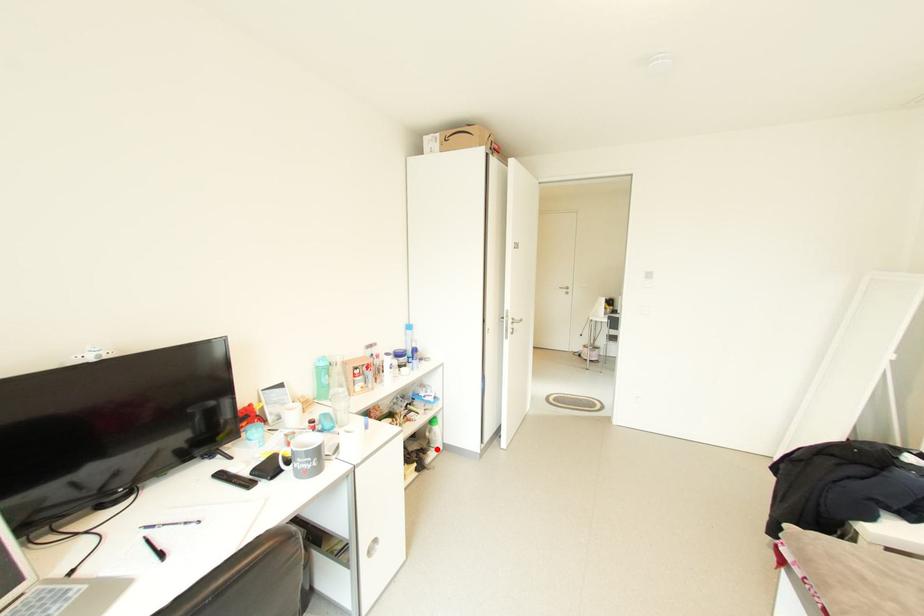
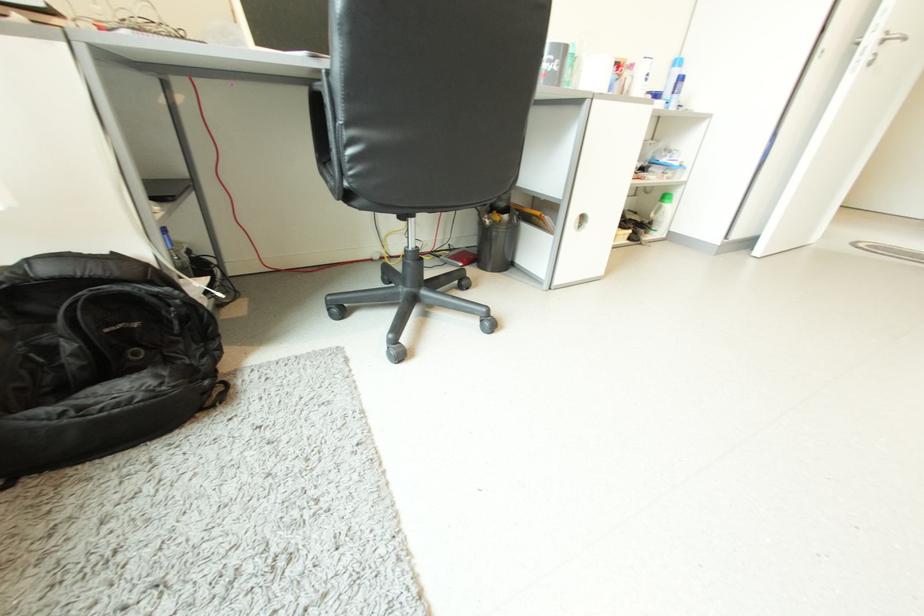
Question: I am providing you with two images of the same scene from different viewpoints. Image1 has a red point marked. In image2, the corresponding 3D location appears at what relative position? Reply with the corresponding letter.

Choices:
 (A) Closer
 (B) Farther

Answer: (A)